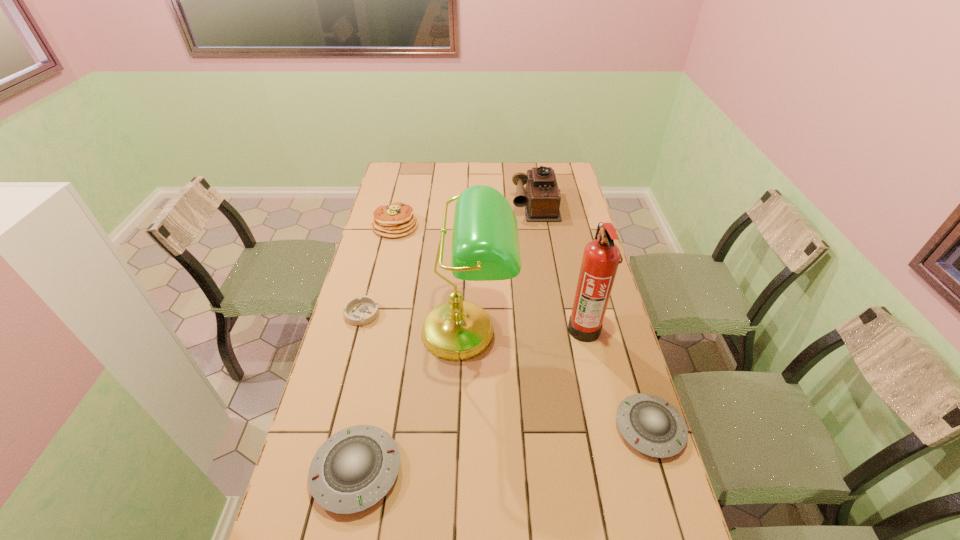
Where is `vacant space positioned on the left of the right saucer`? vacant space positioned on the left of the right saucer is located at coordinates (535, 428).

Locate an element on the screen. vacant point located on the horn of the phonograph_record is located at coordinates (547, 279).

Where is `free point located on the right of the fourth tallest object`? free point located on the right of the fourth tallest object is located at coordinates (432, 226).

This screenshot has height=540, width=960. What are the coordinates of `vacant space located on the desk next to the fourth object from left to right` in the screenshot? It's located at (463, 476).

In order to click on vacant space located on the back of the ashtray in this screenshot , I will do `click(372, 280)`.

Find the location of a particular element. This screenshot has width=960, height=540. vacant space located with the nozzle pointing from the back of the fire extinguisher is located at coordinates (543, 329).

At what (x,y) coordinates should I click in order to perform the action: click on blank area located 0.090m with the nozzle pointing from the back of the fire extinguisher. Please return your answer as a coordinate pair (x, y). The height and width of the screenshot is (540, 960). Looking at the image, I should click on [x=540, y=329].

You are a GUI agent. You are given a task and a screenshot of the screen. Output one action in this format:
    pyautogui.click(x=<x>, y=<y>)
    Task: Click on the vacant space located with the nozzle pointing from the back of the fire extinguisher
    Image resolution: width=960 pixels, height=540 pixels.
    Given the screenshot: What is the action you would take?
    pyautogui.click(x=498, y=329)

Locate an element on the screen. Image resolution: width=960 pixels, height=540 pixels. object that is at the far edge is located at coordinates (541, 198).

The image size is (960, 540). I want to click on object that is at the near edge, so click(360, 463).